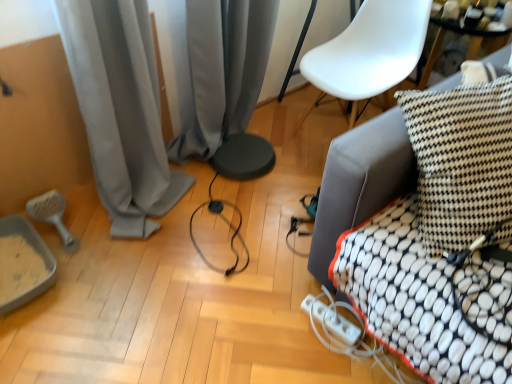
Question: Does white plastic extension cord at lower center have a lesser width compared to white plastic armchair at upper right?

Choices:
 (A) yes
 (B) no

Answer: (A)

Question: Is white plastic extension cord at lower center smaller than white plastic armchair at upper right?

Choices:
 (A) yes
 (B) no

Answer: (A)

Question: Can you confirm if white plastic extension cord at lower center is bigger than white plastic armchair at upper right?

Choices:
 (A) no
 (B) yes

Answer: (A)

Question: Is white plastic extension cord at lower center wider than white plastic armchair at upper right?

Choices:
 (A) yes
 (B) no

Answer: (B)

Question: Does white plastic extension cord at lower center come in front of white plastic armchair at upper right?

Choices:
 (A) no
 (B) yes

Answer: (B)

Question: From their relative heights in the image, would you say white plastic extension cord at lower center is taller or shorter than gray fabric curtain at center, the 2th curtain from the left?

Choices:
 (A) short
 (B) tall

Answer: (A)

Question: Considering their positions, is white plastic extension cord at lower center located in front of or behind gray fabric curtain at center, the 2th curtain from the left?

Choices:
 (A) behind
 (B) front

Answer: (B)

Question: Looking at their shapes, would you say white plastic extension cord at lower center is wider or thinner than gray fabric curtain at center, the 1th curtain viewed from the right?

Choices:
 (A) thin
 (B) wide

Answer: (A)

Question: From a real-world perspective, relative to gray fabric curtain at center, the 1th curtain viewed from the right, is white plastic extension cord at lower center vertically above or below?

Choices:
 (A) above
 (B) below

Answer: (B)

Question: Based on their positions, is gray fabric curtain at lower left, marked as the 1th curtain in a left-to-right arrangement, located to the left or right of white fabric cushion at right?

Choices:
 (A) left
 (B) right

Answer: (A)

Question: Does point (121, 208) appear closer or farther from the camera than point (342, 144)?

Choices:
 (A) farther
 (B) closer

Answer: (A)

Question: Is gray fabric curtain at lower left, which is the 2th curtain in right-to-left order, taller or shorter than white fabric cushion at right?

Choices:
 (A) tall
 (B) short

Answer: (A)

Question: From a real-world perspective, relative to white fabric cushion at right, is gray fabric curtain at lower left, marked as the 1th curtain in a left-to-right arrangement, vertically above or below?

Choices:
 (A) below
 (B) above

Answer: (B)

Question: From a real-world perspective, is black and white checkered pillow at right physically located above or below white plastic extension cord at lower center?

Choices:
 (A) above
 (B) below

Answer: (A)

Question: Is black and white checkered pillow at right wider or thinner than white plastic extension cord at lower center?

Choices:
 (A) thin
 (B) wide

Answer: (B)